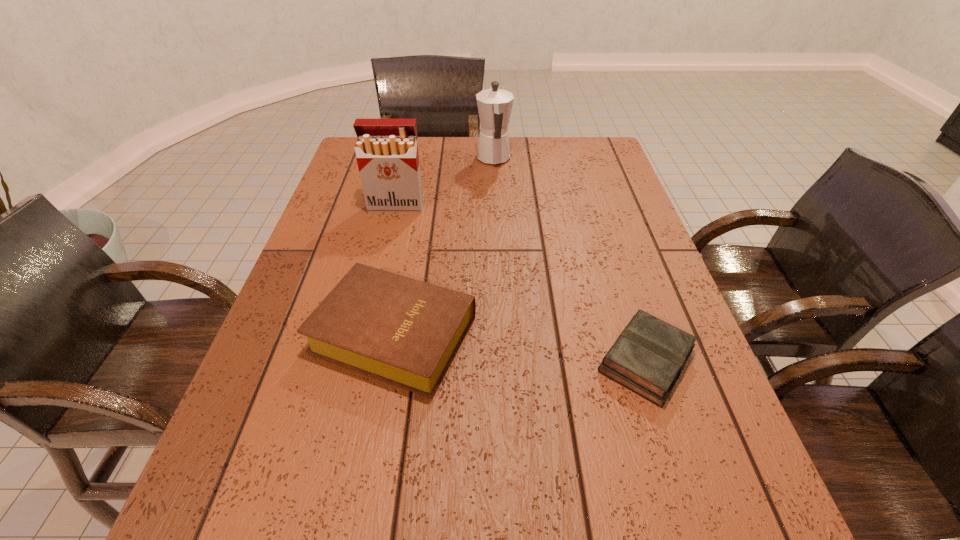
Where is `vacant area that lies between the coffeepot and the second shortest object`? This screenshot has width=960, height=540. vacant area that lies between the coffeepot and the second shortest object is located at coordinates pos(444,246).

This screenshot has width=960, height=540. Identify the location of vacant area that lies between the shortest object and the third nearest object. point(521,283).

The width and height of the screenshot is (960, 540). I want to click on free space between the third nearest object and the farthest object, so click(x=444, y=183).

The height and width of the screenshot is (540, 960). I want to click on free space between the book and the second shortest object, so click(x=520, y=347).

You are a GUI agent. You are given a task and a screenshot of the screen. Output one action in this format:
    pyautogui.click(x=<x>, y=<y>)
    Task: Click on the blank region between the book and the second shortest object
    The image size is (960, 540).
    Given the screenshot: What is the action you would take?
    pyautogui.click(x=520, y=347)

Find the location of a particular element. This screenshot has width=960, height=540. free spot between the farthest object and the second farthest object is located at coordinates (444, 183).

Select which object is the second closest to the Bible. Please provide its 2D coordinates. Your answer should be formatted as a tuple, i.e. [(x, y)], where the tuple contains the x and y coordinates of a point satisfying the conditions above.

[(386, 150)]

Identify the location of object that is the second closest one to the rightmost object. (386, 150).

You are a GUI agent. You are given a task and a screenshot of the screen. Output one action in this format:
    pyautogui.click(x=<x>, y=<y>)
    Task: Click on the vacant area that satisfies the following two spatial constraints: 1. with the lid open on the book; 2. on the left side of the second farthest object
    The image size is (960, 540).
    Given the screenshot: What is the action you would take?
    pyautogui.click(x=360, y=360)

Identify the location of vacant area that satisfies the following two spatial constraints: 1. on the front side of the rightmost object; 2. on the right side of the coffeepot. This screenshot has height=540, width=960. (502, 360).